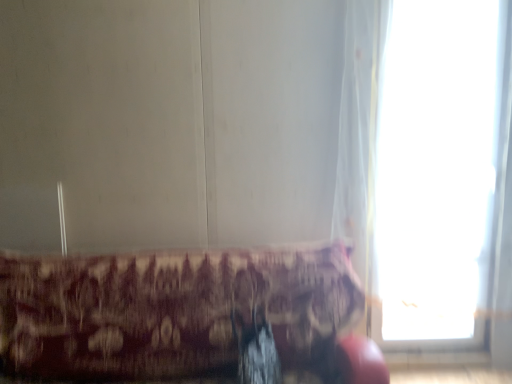
Question: Is there a large distance between transparent glass window at right and patterned fabric cushion at lower center?

Choices:
 (A) no
 (B) yes

Answer: (B)

Question: Is transparent glass window at right beside patterned fabric cushion at lower center?

Choices:
 (A) yes
 (B) no

Answer: (B)

Question: Is transparent glass window at right positioned before patterned fabric cushion at lower center?

Choices:
 (A) yes
 (B) no

Answer: (B)

Question: Considering the relative sizes of transparent glass window at right and patterned fabric cushion at lower center in the image provided, is transparent glass window at right shorter than patterned fabric cushion at lower center?

Choices:
 (A) yes
 (B) no

Answer: (B)

Question: Is transparent glass window at right smaller than patterned fabric cushion at lower center?

Choices:
 (A) yes
 (B) no

Answer: (A)

Question: Considering the relative sizes of transparent glass window at right and patterned fabric cushion at lower center in the image provided, is transparent glass window at right taller than patterned fabric cushion at lower center?

Choices:
 (A) no
 (B) yes

Answer: (B)

Question: Is patterned fabric cushion at lower center at the right side of transparent glass window at right?

Choices:
 (A) yes
 (B) no

Answer: (B)

Question: Does patterned fabric cushion at lower center turn towards transparent glass window at right?

Choices:
 (A) no
 (B) yes

Answer: (A)

Question: Is the surface of patterned fabric cushion at lower center in direct contact with transparent glass window at right?

Choices:
 (A) no
 (B) yes

Answer: (A)

Question: Is patterned fabric cushion at lower center facing away from transparent glass window at right?

Choices:
 (A) no
 (B) yes

Answer: (A)

Question: From the image's perspective, does patterned fabric cushion at lower center appear lower than transparent glass window at right?

Choices:
 (A) no
 (B) yes

Answer: (B)

Question: Can we say patterned fabric cushion at lower center lies outside transparent glass window at right?

Choices:
 (A) no
 (B) yes

Answer: (B)

Question: From a real-world perspective, is patterned fabric cushion at lower center positioned above or below transparent glass window at right?

Choices:
 (A) below
 (B) above

Answer: (A)